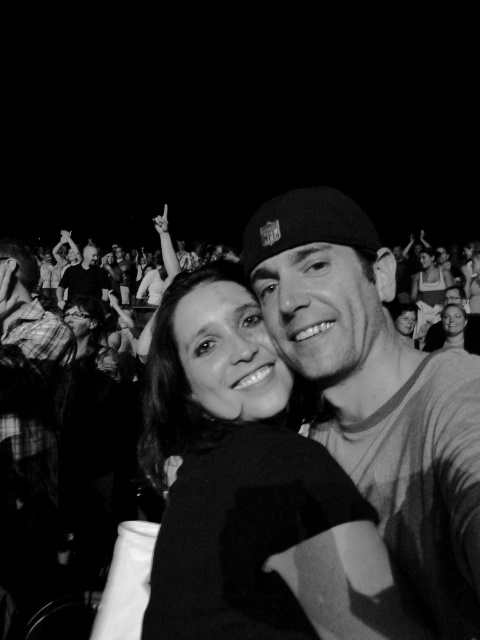
Question: In this image, where is plaid shirt at left located relative to smooth skin man at upper left?

Choices:
 (A) above
 (B) below

Answer: (B)

Question: Can you confirm if matte white tank top at center is positioned to the left of smooth skin man at upper left?

Choices:
 (A) no
 (B) yes

Answer: (A)

Question: Can you confirm if matte white tank top at center is positioned above smooth skin man at upper left?

Choices:
 (A) yes
 (B) no

Answer: (B)

Question: Which point is closer to the camera?

Choices:
 (A) plaid shirt at left
 (B) smooth black shirt at center
 (C) smooth skin man at upper left

Answer: (B)

Question: Which object is farther from the camera taking this photo?

Choices:
 (A) smooth black shirt at center
 (B) plaid shirt at left

Answer: (B)

Question: Which of the following is the closest to the observer?

Choices:
 (A) smooth skin man at upper left
 (B) plaid shirt at left

Answer: (B)